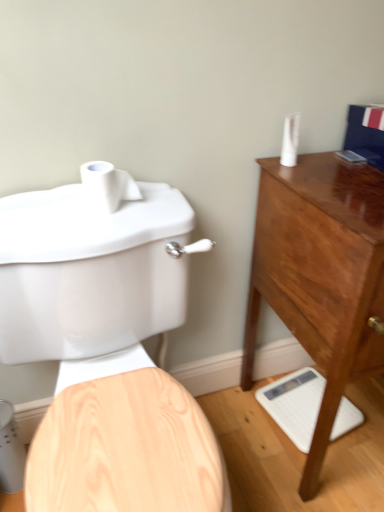
Where is `vacant space situated above mahogany wood chest of drawers at right (from a real-world perspective)`? Image resolution: width=384 pixels, height=512 pixels. vacant space situated above mahogany wood chest of drawers at right (from a real-world perspective) is located at coordinates point(345,174).